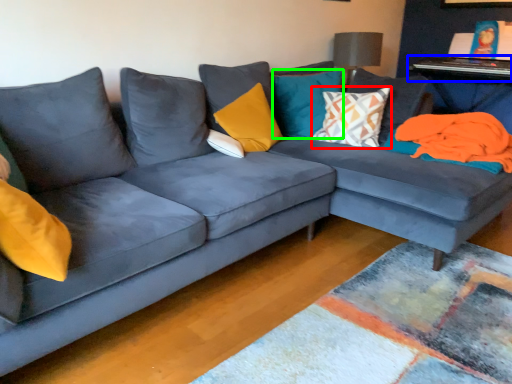
Question: Which object is the farthest from pillow (highlighted by a red box)? Choose among these: table (highlighted by a blue box) or pillow (highlighted by a green box).

Choices:
 (A) table
 (B) pillow

Answer: (A)